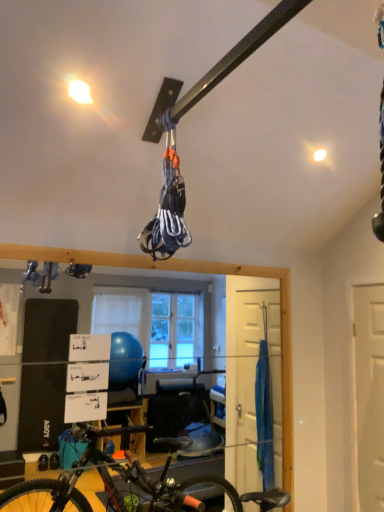
Where is `white matte door at right`? This screenshot has height=512, width=384. white matte door at right is located at coordinates (370, 393).

What do you see at coordinates (370, 393) in the screenshot? Image resolution: width=384 pixels, height=512 pixels. I see `white matte door at right` at bounding box center [370, 393].

Where is `black matte bicycle at lower left`? black matte bicycle at lower left is located at coordinates (127, 483).

The width and height of the screenshot is (384, 512). What do you see at coordinates (127, 483) in the screenshot?
I see `black matte bicycle at lower left` at bounding box center [127, 483].

Measure the distance between black matte bicycle at lower left and camera.

black matte bicycle at lower left is 1.58 meters away from camera.

Find the location of a particular element. Image resolution: width=384 pixels, height=512 pixels. white matte door at right is located at coordinates (370, 393).

Is white matte door at right at the left side of black matte bicycle at lower left?

In fact, white matte door at right is to the right of black matte bicycle at lower left.

Considering their positions, is white matte door at right located in front of or behind black matte bicycle at lower left?

In the image, white matte door at right appears behind black matte bicycle at lower left.

Which is behind, point (368, 343) or point (223, 489)?

Point (223, 489)

From the image's perspective, between white matte door at right and black matte bicycle at lower left, which one is located above?

white matte door at right.

From a real-world perspective, is white matte door at right below black matte bicycle at lower left?

Actually, white matte door at right is physically above black matte bicycle at lower left in the real world.

Considering the sizes of objects white matte door at right and black matte bicycle at lower left in the image provided, who is thinner, white matte door at right or black matte bicycle at lower left?

white matte door at right.

Considering the relative sizes of white matte door at right and black matte bicycle at lower left in the image provided, is white matte door at right shorter than black matte bicycle at lower left?

No.

Considering the sizes of objects white matte door at right and black matte bicycle at lower left in the image provided, who is smaller, white matte door at right or black matte bicycle at lower left?

white matte door at right.

Is white matte door at right inside or outside of black matte bicycle at lower left?

The correct answer is: outside.

Is white matte door at right not close to black matte bicycle at lower left?

white matte door at right is far away from black matte bicycle at lower left.

Based on the photo, is white matte door at right facing towards black matte bicycle at lower left?

Yes, white matte door at right is facing black matte bicycle at lower left.

How much distance is there between white matte door at right and black matte bicycle at lower left?

white matte door at right is 4.60 feet away from black matte bicycle at lower left.

This screenshot has height=512, width=384. What are the coordinates of `bicycle beneath the white matte door at right (from a real-world perspective)` in the screenshot? It's located at (127, 483).

Can you confirm if black matte bicycle at lower left is positioned to the right of white matte door at right?

Result: In fact, black matte bicycle at lower left is to the left of white matte door at right.

Is black matte bicycle at lower left positioned in front of white matte door at right?

Yes.

Which point is more distant from viewer, (184, 488) or (359, 424)?

Positioned behind is point (359, 424).

From the image's perspective, is black matte bicycle at lower left above or below white matte door at right?

From the image's perspective, black matte bicycle at lower left appears below white matte door at right.

Consider the image. From a real-world perspective, who is located lower, black matte bicycle at lower left or white matte door at right?

black matte bicycle at lower left.

In terms of width, does black matte bicycle at lower left look wider or thinner when compared to white matte door at right?

Considering their sizes, black matte bicycle at lower left looks broader than white matte door at right.

Who is shorter, black matte bicycle at lower left or white matte door at right?

With less height is black matte bicycle at lower left.

Consider the image. Who is smaller, black matte bicycle at lower left or white matte door at right?

white matte door at right is smaller.

Is white matte door at right located within black matte bicycle at lower left?

No, white matte door at right is not surrounded by black matte bicycle at lower left.

Is black matte bicycle at lower left positioned far away from white matte door at right?

black matte bicycle at lower left is far away from white matte door at right.

Could you tell me if black matte bicycle at lower left is turned towards white matte door at right?

No, black matte bicycle at lower left is not oriented towards white matte door at right.

What's the angular difference between black matte bicycle at lower left and white matte door at right's facing directions?

They differ by 0.131 degrees in their facing directions.

How far apart are black matte bicycle at lower left and white matte door at right?

A: black matte bicycle at lower left and white matte door at right are 4.60 feet apart.

Locate an element on the screen. The image size is (384, 512). door positioned vertically above the black matte bicycle at lower left (from a real-world perspective) is located at coordinates (370, 393).

This screenshot has width=384, height=512. Identify the location of door on the right of black matte bicycle at lower left. (370, 393).

This screenshot has width=384, height=512. What are the coordinates of `bicycle that is on the left side of white matte door at right` in the screenshot? It's located at (127, 483).